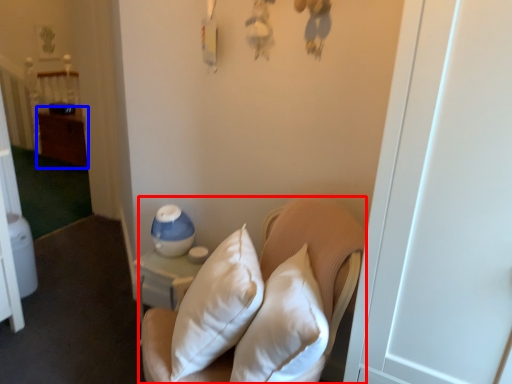
Question: Which point is closer to the camera, furniture (highlighted by a red box) or dresser (highlighted by a blue box)?

Choices:
 (A) furniture
 (B) dresser

Answer: (A)